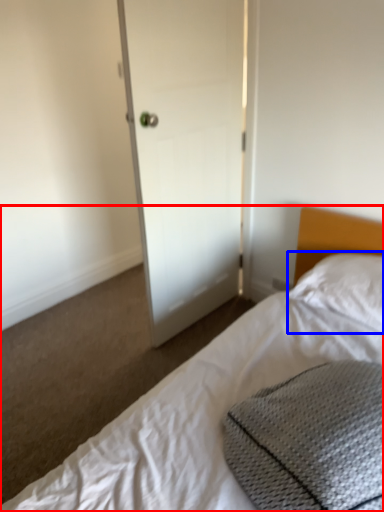
Question: Which of the following is the closest to the observer, bed (highlighted by a red box) or pillow (highlighted by a blue box)?

Choices:
 (A) bed
 (B) pillow

Answer: (A)